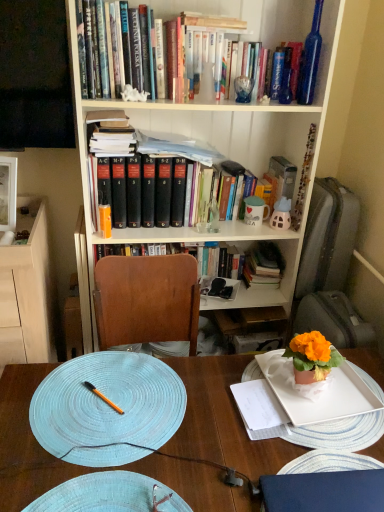
The width and height of the screenshot is (384, 512). I want to click on free location to the right of blue woven placemat at center, which is the 3th plate from right to left, so click(247, 416).